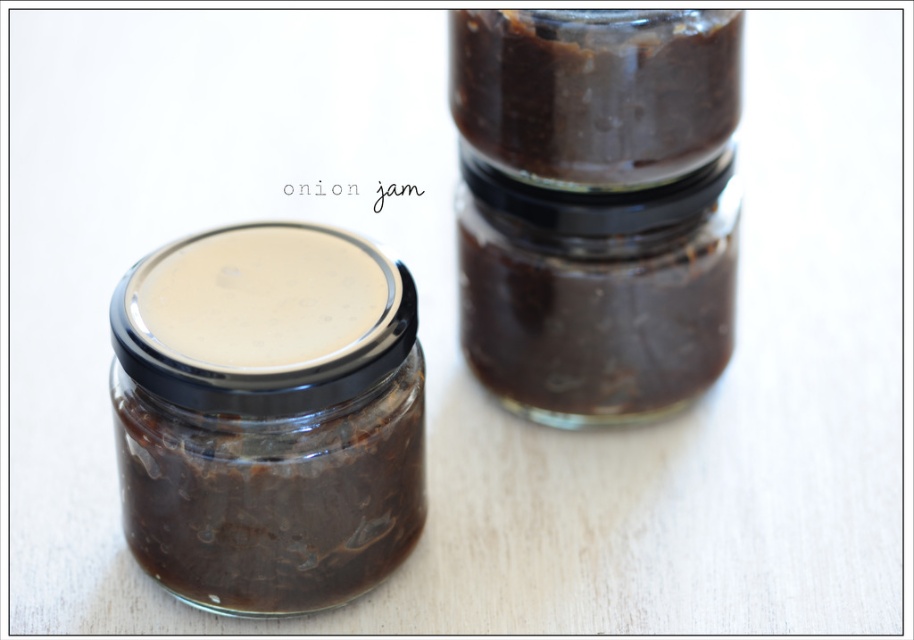
Question: Which point appears farthest from the camera in this image?

Choices:
 (A) (326, 362)
 (B) (664, 189)
 (C) (696, 68)

Answer: (B)

Question: Which of these objects is positioned closest to the matte glass jar at left?

Choices:
 (A) dark brown glass jar at upper center
 (B) dark brown glass jar at center

Answer: (B)

Question: Observing the image, what is the correct spatial positioning of dark brown glass jar at center in reference to matte glass jar at left?

Choices:
 (A) right
 (B) left

Answer: (A)

Question: Is dark brown glass jar at center wider than matte glass jar at left?

Choices:
 (A) no
 (B) yes

Answer: (B)

Question: Is dark brown glass jar at center positioned before matte glass jar at left?

Choices:
 (A) no
 (B) yes

Answer: (A)

Question: Which point is farther to the camera?

Choices:
 (A) (725, 337)
 (B) (649, 100)
 (C) (222, 529)

Answer: (A)